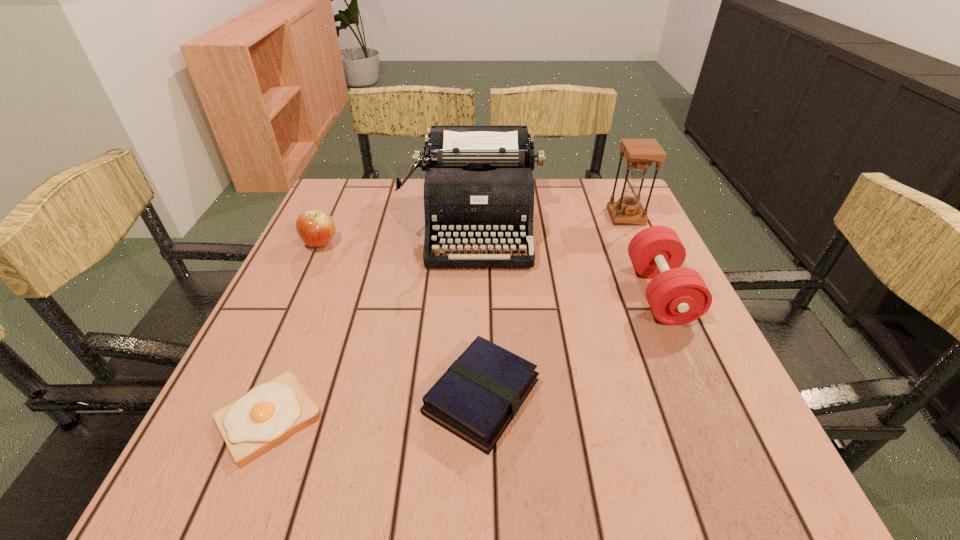
Locate an element on the screen. The image size is (960, 540). vacant position in the image that satisfies the following two spatial constraints: 1. on the typing side of the fifth tallest object; 2. on the right side of the typewriter is located at coordinates (472, 396).

Where is `vacant space that satisfies the following two spatial constraints: 1. on the front side of the toast; 2. on the left side of the third shortest object`? vacant space that satisfies the following two spatial constraints: 1. on the front side of the toast; 2. on the left side of the third shortest object is located at coordinates (241, 418).